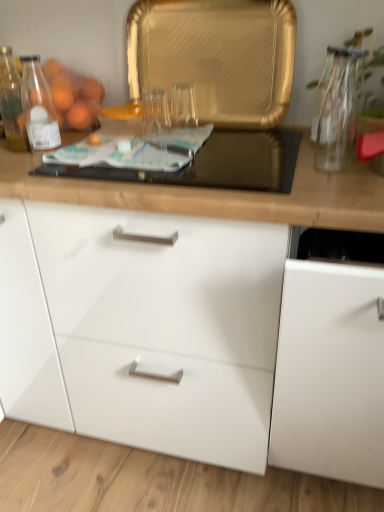
Question: From the image's perspective, is white glossy cabinet at right, the 1th cabinetry viewed from the right, above transparent glass vase at upper right?

Choices:
 (A) no
 (B) yes

Answer: (A)

Question: From a real-world perspective, is white glossy cabinet at right, which is the 2th cabinetry in left-to-right order, physically above transparent glass vase at upper right?

Choices:
 (A) yes
 (B) no

Answer: (B)

Question: Is white glossy cabinet at right, the 1th cabinetry viewed from the right, bigger than transparent glass vase at upper right?

Choices:
 (A) no
 (B) yes

Answer: (B)

Question: Would you consider white glossy cabinet at right, which is the 2th cabinetry in left-to-right order, to be distant from transparent glass vase at upper right?

Choices:
 (A) no
 (B) yes

Answer: (A)

Question: Can you confirm if white glossy cabinet at right, the 1th cabinetry viewed from the right, is taller than transparent glass vase at upper right?

Choices:
 (A) no
 (B) yes

Answer: (B)

Question: Is white glossy cabinet at right, which is the 2th cabinetry in left-to-right order, in contact with transparent glass vase at upper right?

Choices:
 (A) yes
 (B) no

Answer: (B)

Question: Is translucent glass bottle at left next to transparent glass vase at right and touching it?

Choices:
 (A) yes
 (B) no

Answer: (B)

Question: Is transparent glass vase at right located within translucent glass bottle at left?

Choices:
 (A) yes
 (B) no

Answer: (B)

Question: Is translucent glass bottle at left at the right side of transparent glass vase at right?

Choices:
 (A) yes
 (B) no

Answer: (B)

Question: Can you confirm if translucent glass bottle at left is shorter than transparent glass vase at right?

Choices:
 (A) no
 (B) yes

Answer: (B)

Question: Is translucent glass bottle at left wider than transparent glass vase at right?

Choices:
 (A) no
 (B) yes

Answer: (B)

Question: Is translucent glass bottle at left not inside transparent glass vase at right?

Choices:
 (A) yes
 (B) no

Answer: (A)

Question: Is translucent glass bottle at left oriented away from transparent glass vase at upper right?

Choices:
 (A) no
 (B) yes

Answer: (A)